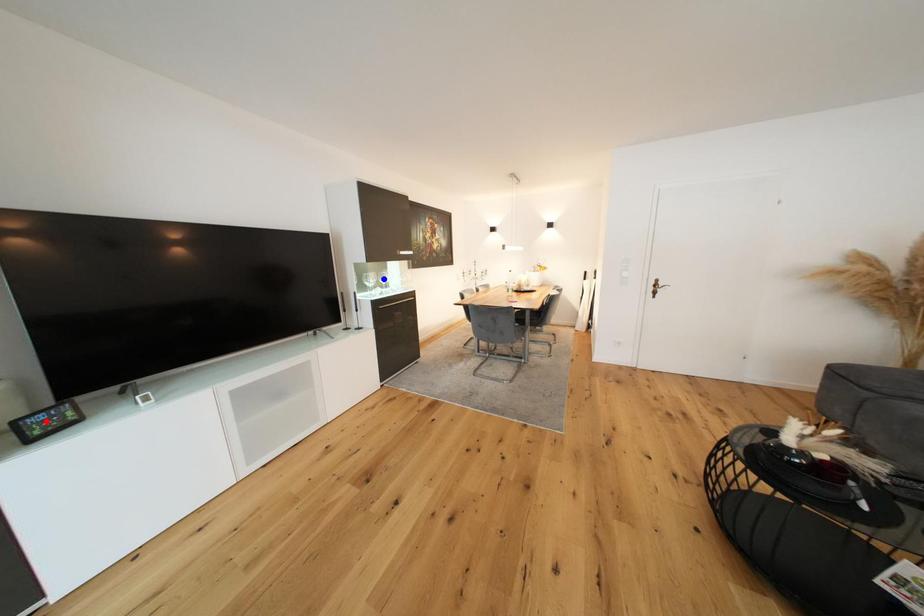
Question: Which of the two points in the image is closer to the camera?

Choices:
 (A) Blue point is closer.
 (B) Red point is closer.

Answer: (B)